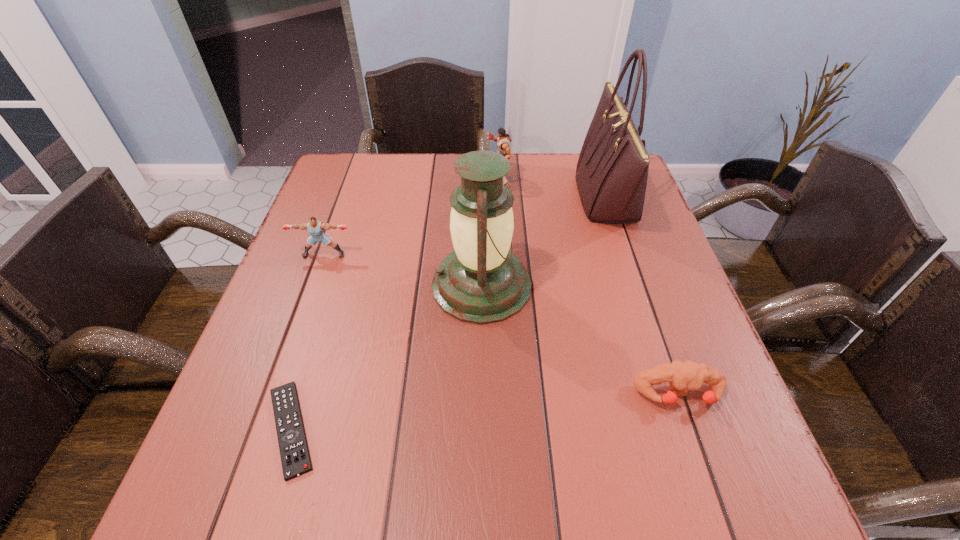
At what (x,y) coordinates should I click in order to perform the action: click on handbag. Please return your answer as a coordinate pair (x, y). Looking at the image, I should click on (612, 170).

The width and height of the screenshot is (960, 540). Identify the location of lantern. (481, 282).

At what (x,y) coordinates should I click in order to perform the action: click on the third tallest object. Please return your answer as a coordinate pair (x, y). Looking at the image, I should click on (503, 141).

Image resolution: width=960 pixels, height=540 pixels. In order to click on the farthest puncher in this screenshot , I will do [503, 141].

Image resolution: width=960 pixels, height=540 pixels. Find the location of `the second farthest puncher`. the second farthest puncher is located at coordinates (315, 228).

Where is `the fourth tallest object`? The width and height of the screenshot is (960, 540). the fourth tallest object is located at coordinates (315, 228).

This screenshot has height=540, width=960. In order to click on the second shortest object in this screenshot , I will do `click(683, 376)`.

The width and height of the screenshot is (960, 540). I want to click on the rightmost puncher, so click(683, 376).

The image size is (960, 540). Find the location of `the shortest object`. the shortest object is located at coordinates (295, 458).

I want to click on free space located on the front-facing side of the handbag, so click(x=513, y=197).